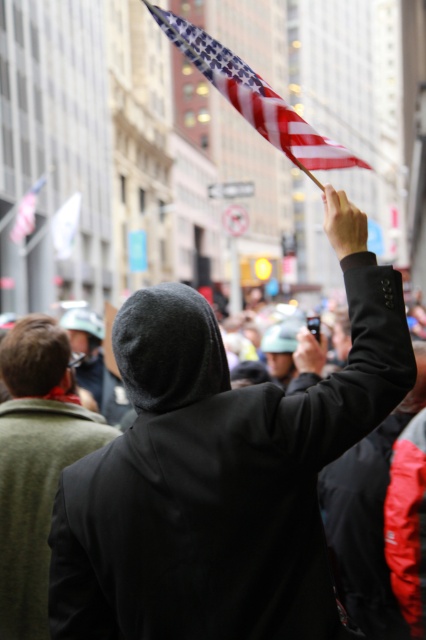
Question: Which object appears farthest from the camera in this image?

Choices:
 (A) smooth skin hand at upper right
 (B) white fabric flag at upper left
 (C) dark gray hoodie at center
 (D) matte black phone at upper right

Answer: (B)

Question: Can you confirm if smooth skin hand at upper right is positioned below matte black phone at upper right?

Choices:
 (A) yes
 (B) no

Answer: (B)

Question: Can you confirm if black matte coat at upper center is positioned below american flag at upper left?

Choices:
 (A) no
 (B) yes

Answer: (B)

Question: Which object is positioned closest to the white fabric flag at upper left?

Choices:
 (A) black matte coat at upper center
 (B) american flag at upper left

Answer: (B)

Question: Which object appears closest to the camera in this image?

Choices:
 (A) smooth skin hand at upper right
 (B) american flag at upper center
 (C) white fabric flag at upper left
 (D) dark gray hoodie at center

Answer: (A)

Question: Does black matte coat at upper center have a lesser width compared to matte black phone at upper right?

Choices:
 (A) no
 (B) yes

Answer: (A)